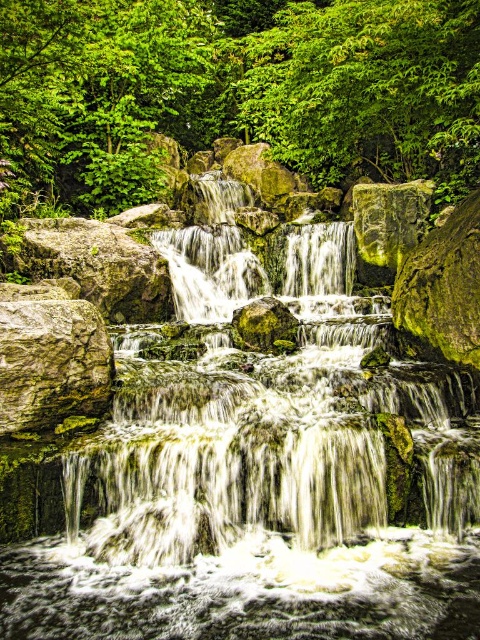
You are a hiker standing at the base of the waterfall. You notice a green leafy tree at upper center and a rough textured rock at left. Which object is positioned higher in the scene?

The green leafy tree at upper center is positioned higher than the rough textured rock at left.

You are standing at the edge of the waterfall and want to place a small decorative statue between the rough textured rock at left and the green mossy rock at right. Based on their positions, which rock should the statue be closer to if you want it to be more visible from your current viewpoint?

The statue should be placed closer to the rough textured rock at left because it is in front of the green mossy rock at right, making it more visible from your current viewpoint.

You are a hiker standing at the base of the waterfall and want to reach a point closer to you. Which of the two points, point (40, 60) or point (62, 355), should you head towards?

Point (40, 60) is further to the viewer than point (62, 355), so you should head towards point (62, 355) as it is closer to you.